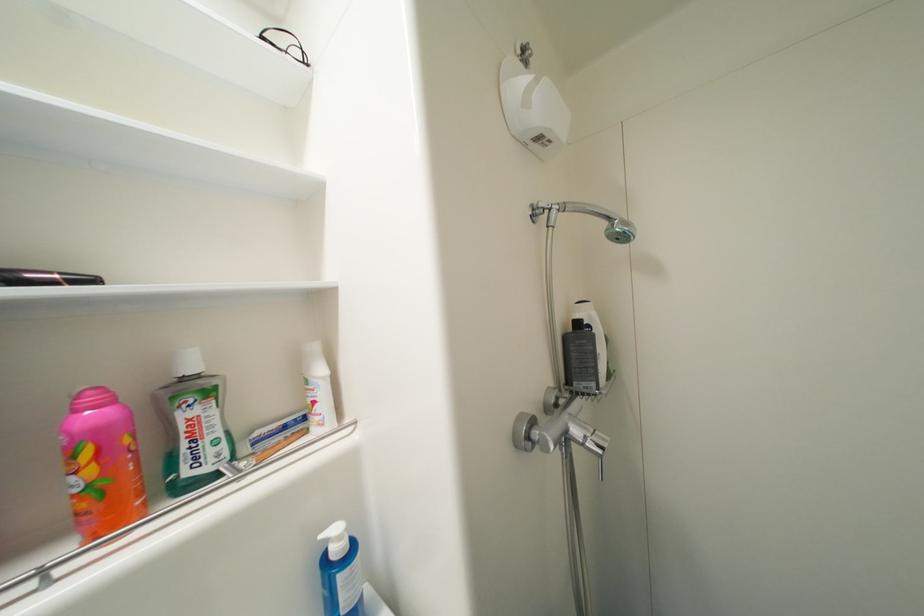
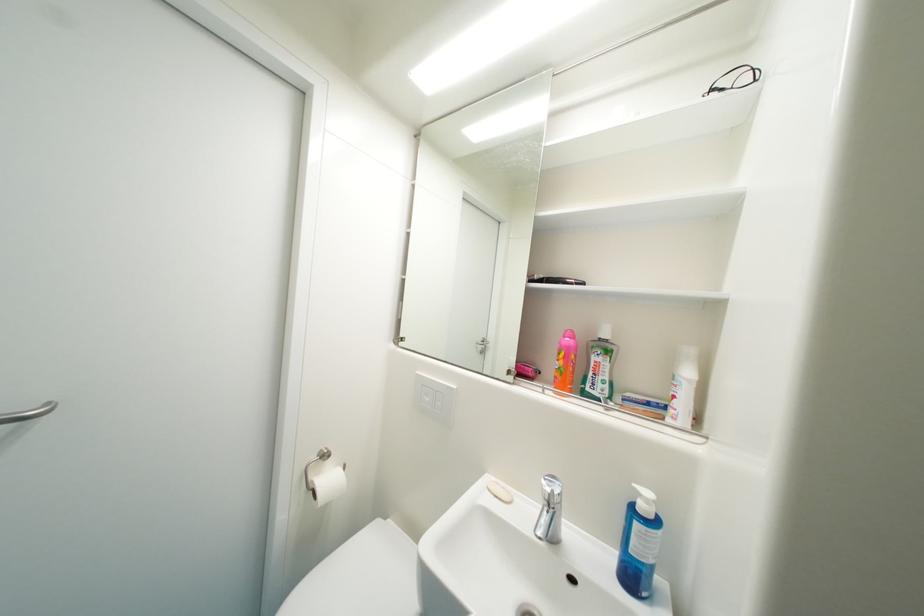
The point at (108, 485) is marked in the first image. Where is the corresponding point in the second image?

(569, 371)